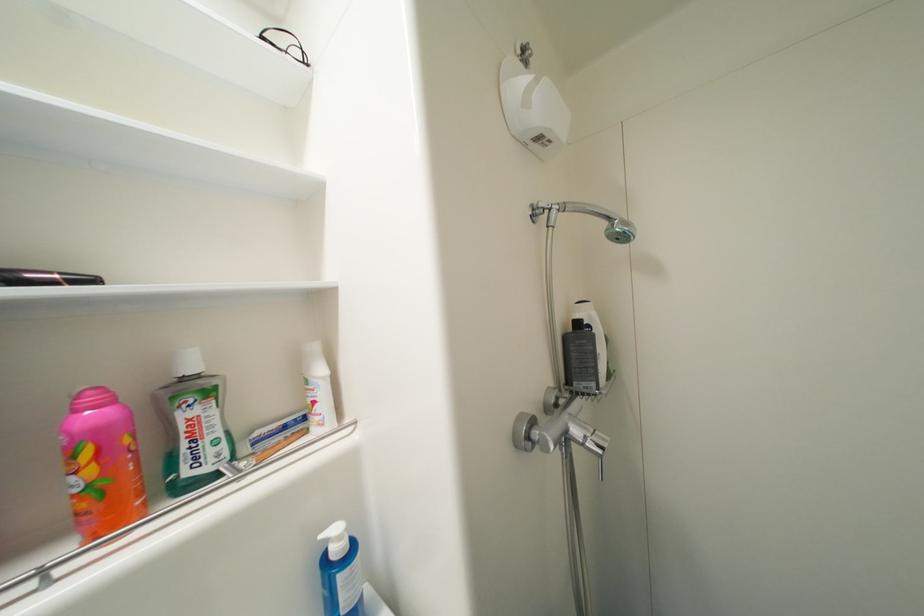
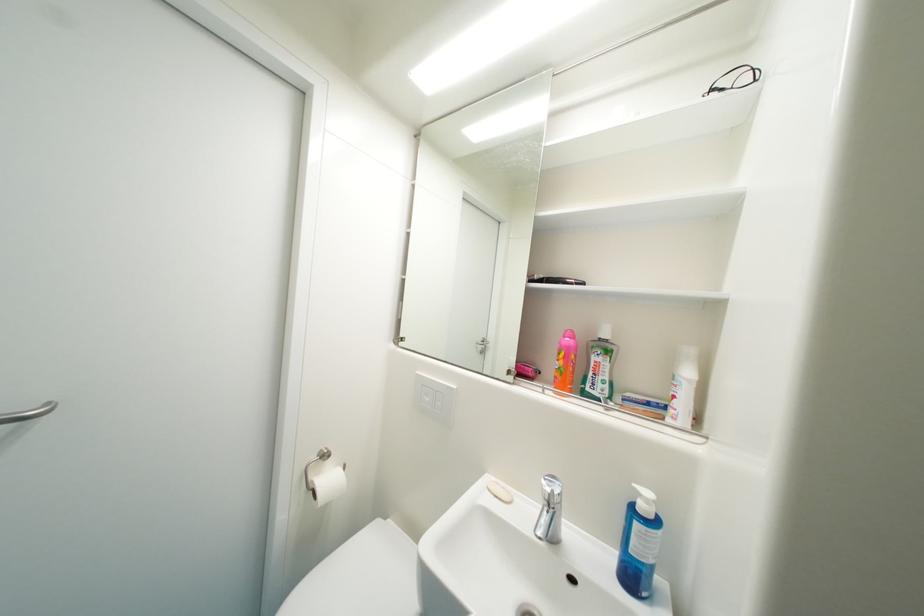
The point at (108, 485) is marked in the first image. Where is the corresponding point in the second image?

(569, 371)